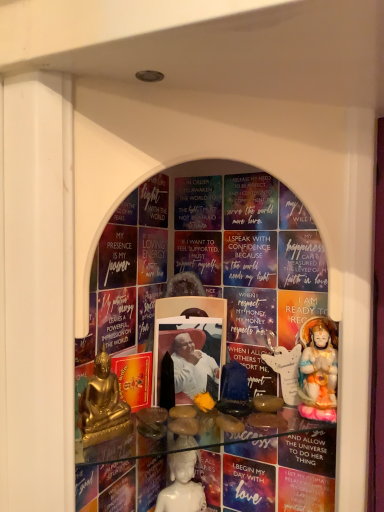
Where is `porcelain statue at right, the second person viewed from the back`? This screenshot has width=384, height=512. porcelain statue at right, the second person viewed from the back is located at coordinates (318, 366).

How many degrees apart are the facing directions of porcelain statue at right, which appears as the 3th person when viewed from the left, and white porcelain statue at center, the first person when ordered from bottom to top?

The angular difference between porcelain statue at right, which appears as the 3th person when viewed from the left, and white porcelain statue at center, the first person when ordered from bottom to top, is 2.32 degrees.

Which is correct: porcelain statue at right, which appears as the 3th person when viewed from the left, is inside white porcelain statue at center, the third person positioned from the top, or outside of it?

porcelain statue at right, which appears as the 3th person when viewed from the left, is located beyond the bounds of white porcelain statue at center, the third person positioned from the top.

Does point (313, 341) come in front of point (183, 444)?

Yes, it is.

How distant is porcelain statue at right, which appears as the 3th person when viewed from the left, from white porcelain statue at center, the third person positioned from the top?

They are 10.68 inches apart.

Can you tell me how much white porcelain statue at center, the second person in the right-to-left sequence, and gold metallic statue at lower left, which is counted as the third person, starting from the back, differ in facing direction?

The facing directions of white porcelain statue at center, the second person in the right-to-left sequence, and gold metallic statue at lower left, which is counted as the third person, starting from the back, are 73.7 degrees apart.

Between white porcelain statue at center, which is the second person from left to right, and gold metallic statue at lower left, which ranks as the second person in bottom-to-top order, which one has more height?

gold metallic statue at lower left, which ranks as the second person in bottom-to-top order.

From the image's perspective, which one is positioned higher, white porcelain statue at center, the first person when ordered from bottom to top, or gold metallic statue at lower left, which is the 2th person in top-to-bottom order?

gold metallic statue at lower left, which is the 2th person in top-to-bottom order, is shown above in the image.

Is gold metallic statue at lower left, which is the 2th person in top-to-bottom order, at the back of white porcelain statue at center, marked as the first person in a back-to-front arrangement?

No, white porcelain statue at center, marked as the first person in a back-to-front arrangement, is not facing the opposite direction of gold metallic statue at lower left, which is the 2th person in top-to-bottom order.

How far apart are gold metallic statue at lower left, which is the third person from right to left, and white porcelain statue at center, which is the second person from left to right?

8.62 inches.

What's the angular difference between gold metallic statue at lower left, which is the 2th person in top-to-bottom order, and white porcelain statue at center, the second person in the right-to-left sequence,'s facing directions?

gold metallic statue at lower left, which is the 2th person in top-to-bottom order, and white porcelain statue at center, the second person in the right-to-left sequence, are facing 73.7 degrees away from each other.

Is point (111, 402) behind point (180, 475)?

No, (111, 402) is closer to viewer.

Locate an element on the screen. The height and width of the screenshot is (512, 384). person that is the 1st one when counting rightward from the gold metallic statue at lower left, the 1th person from the left is located at coordinates (182, 485).

Considering the points (171, 476) and (333, 405), which point is in front, point (171, 476) or point (333, 405)?

The point (333, 405) is more forward.

From the image's perspective, is white porcelain statue at center, which is the second person from left to right, under porcelain statue at right, the 1th person in the top-to-bottom sequence?

Yes, from the image's perspective, white porcelain statue at center, which is the second person from left to right, is below porcelain statue at right, the 1th person in the top-to-bottom sequence.

Is white porcelain statue at center, the second person in the right-to-left sequence, situated inside porcelain statue at right, positioned as the 3th person in bottom-to-top order, or outside?

white porcelain statue at center, the second person in the right-to-left sequence, is not enclosed by porcelain statue at right, positioned as the 3th person in bottom-to-top order.

Is white porcelain statue at center, which is the second person from left to right, positioned with its back to porcelain statue at right, the second person viewed from the back?

white porcelain statue at center, which is the second person from left to right, is not turned away from porcelain statue at right, the second person viewed from the back.

Is porcelain statue at right, placed as the first person when sorted from right to left, wider than gold metallic statue at lower left, which is the third person from right to left?

Yes, porcelain statue at right, placed as the first person when sorted from right to left, is wider than gold metallic statue at lower left, which is the third person from right to left.

Find the location of a particular element. person that appears above the gold metallic statue at lower left, placed as the first person when sorted from front to back (from a real-world perspective) is located at coordinates (318, 366).

Can you confirm if porcelain statue at right, positioned as the 3th person in bottom-to-top order, is positioned to the left of gold metallic statue at lower left, which is the 2th person in top-to-bottom order?

In fact, porcelain statue at right, positioned as the 3th person in bottom-to-top order, is to the right of gold metallic statue at lower left, which is the 2th person in top-to-bottom order.

Is point (300, 362) positioned before point (103, 376)?

No, it is behind (103, 376).

Which is behind, gold metallic statue at lower left, the 1th person from the left, or porcelain statue at right, the second person viewed from the back?

porcelain statue at right, the second person viewed from the back, is further away from the camera.

Can porcelain statue at right, placed as the first person when sorted from right to left, be found inside gold metallic statue at lower left, which is counted as the third person, starting from the back?

That's incorrect, porcelain statue at right, placed as the first person when sorted from right to left, is not inside gold metallic statue at lower left, which is counted as the third person, starting from the back.

What's the angular difference between gold metallic statue at lower left, placed as the first person when sorted from front to back, and porcelain statue at right, which appears as the 3th person when viewed from the left,'s facing directions?

They differ by 71.4 degrees in their facing directions.

From a real-world perspective, is gold metallic statue at lower left, the 1th person from the left, on top of porcelain statue at right, positioned as the 3th person in bottom-to-top order?

No, from a real-world perspective, gold metallic statue at lower left, the 1th person from the left, is not over porcelain statue at right, positioned as the 3th person in bottom-to-top order

Where is `person behind the porcelain statue at right, which appears as the 3th person when viewed from the left`? This screenshot has width=384, height=512. person behind the porcelain statue at right, which appears as the 3th person when viewed from the left is located at coordinates (182, 485).

At what (x,y) coordinates should I click in order to perform the action: click on the 1st person counting from the right side of the gold metallic statue at lower left, which ranks as the second person in bottom-to-top order. Please return your answer as a coordinate pair (x, y). The image size is (384, 512). Looking at the image, I should click on (182, 485).

When comparing their distances from white porcelain statue at center, the 3th person when ordered from front to back, does gold metallic statue at lower left, which ranks as the second person in bottom-to-top order, or porcelain statue at right, which appears as the 3th person when viewed from the left, seem further?

porcelain statue at right, which appears as the 3th person when viewed from the left, is positioned further to the anchor white porcelain statue at center, the 3th person when ordered from front to back.

Estimate the real-world distances between objects in this image. Which object is closer to porcelain statue at right, which appears as the 3th person when viewed from the left, white porcelain statue at center, the third person positioned from the top, or gold metallic statue at lower left, which is the 2th person in top-to-bottom order?

white porcelain statue at center, the third person positioned from the top, is positioned closer to the anchor porcelain statue at right, which appears as the 3th person when viewed from the left.

When comparing their distances from gold metallic statue at lower left, the 1th person from the left, does white porcelain statue at center, marked as the first person in a back-to-front arrangement, or porcelain statue at right, the 1th person in the top-to-bottom sequence, seem further?

porcelain statue at right, the 1th person in the top-to-bottom sequence, lies further to gold metallic statue at lower left, the 1th person from the left, than the other object.

Which object lies nearer to the anchor point white porcelain statue at center, the third person positioned from the top, porcelain statue at right, placed as the first person when sorted from right to left, or gold metallic statue at lower left, placed as the first person when sorted from front to back?

gold metallic statue at lower left, placed as the first person when sorted from front to back.

From the image, which object appears to be nearer to porcelain statue at right, the second person viewed from the back, gold metallic statue at lower left, which is the 2th person in top-to-bottom order, or white porcelain statue at center, marked as the first person in a back-to-front arrangement?

The object closer to porcelain statue at right, the second person viewed from the back, is white porcelain statue at center, marked as the first person in a back-to-front arrangement.

Estimate the real-world distances between objects in this image. Which object is further from gold metallic statue at lower left, which is the third person from right to left, porcelain statue at right, the 1th person in the top-to-bottom sequence, or white porcelain statue at center, which is the second person from left to right?

porcelain statue at right, the 1th person in the top-to-bottom sequence, is positioned further to the anchor gold metallic statue at lower left, which is the third person from right to left.

What are the coordinates of `person located between gold metallic statue at lower left, placed as the first person when sorted from front to back, and porcelain statue at right, positioned as the 3th person in bottom-to-top order, in the left-right direction` in the screenshot? It's located at (182, 485).